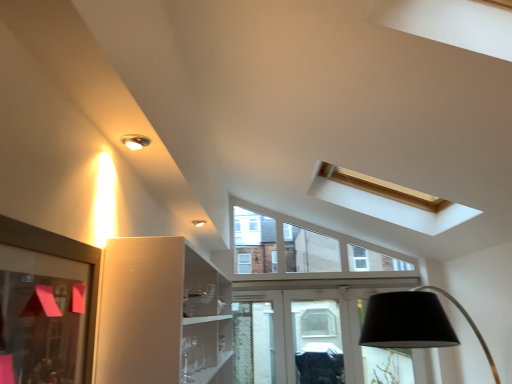
Describe the element at coordinates (135, 141) in the screenshot. I see `matte silver light fixture at upper left` at that location.

The image size is (512, 384). What are the coordinates of `matte silver light fixture at upper left` in the screenshot? It's located at (135, 141).

Describe the element at coordinates (65, 258) in the screenshot. I see `matte glass picture frame at left` at that location.

Locate an element on the screen. This screenshot has height=384, width=512. matte glass picture frame at left is located at coordinates (65, 258).

What are the coordinates of `matte silver light fixture at upper left` in the screenshot? It's located at point(135,141).

Does matte silver light fixture at upper left appear on the right side of matte glass picture frame at left?

Indeed, matte silver light fixture at upper left is positioned on the right side of matte glass picture frame at left.

Is matte silver light fixture at upper left further to the viewer compared to matte glass picture frame at left?

That is True.

Considering the positions of points (124, 141) and (88, 328), is point (124, 141) farther from camera compared to point (88, 328)?

Yes, point (124, 141) is farther from viewer.

From the image's perspective, which object appears higher, matte silver light fixture at upper left or matte glass picture frame at left?

From the image's view, matte silver light fixture at upper left is above.

From a real-world perspective, is matte silver light fixture at upper left below matte glass picture frame at left?

No, from a real-world perspective, matte silver light fixture at upper left is not under matte glass picture frame at left.

Which object is thinner, matte silver light fixture at upper left or matte glass picture frame at left?

Thinner between the two is matte glass picture frame at left.

Is matte silver light fixture at upper left taller or shorter than matte glass picture frame at left?

In the image, matte silver light fixture at upper left appears to be shorter than matte glass picture frame at left.

Between matte silver light fixture at upper left and matte glass picture frame at left, which one has smaller size?

Smaller between the two is matte silver light fixture at upper left.

From the picture: Choose the correct answer: Is matte silver light fixture at upper left inside matte glass picture frame at left or outside it?

The correct answer is: outside.

Are matte silver light fixture at upper left and matte glass picture frame at left located far from each other?

Actually, matte silver light fixture at upper left and matte glass picture frame at left are a little close together.

Could you tell me if matte silver light fixture at upper left is facing matte glass picture frame at left?

No, matte silver light fixture at upper left is not oriented towards matte glass picture frame at left.

Measure the distance between matte silver light fixture at upper left and matte glass picture frame at left.

matte silver light fixture at upper left and matte glass picture frame at left are 20.21 inches apart from each other.

Identify the location of light fixture to the right of matte glass picture frame at left. (135, 141).

In the image, is matte glass picture frame at left on the left side or the right side of matte silver light fixture at upper left?

Based on their positions, matte glass picture frame at left is located to the left of matte silver light fixture at upper left.

Is matte glass picture frame at left further to the viewer compared to matte silver light fixture at upper left?

No, matte glass picture frame at left is closer to the viewer.

Is point (23, 235) more distant than point (127, 135)?

No, (23, 235) is closer to viewer.

From the image's perspective, does matte glass picture frame at left appear higher than matte silver light fixture at upper left?

Incorrect, from the image's perspective, matte glass picture frame at left is lower than matte silver light fixture at upper left.

From a real-world perspective, which is physically below, matte glass picture frame at left or matte silver light fixture at upper left?

From a 3D spatial view, matte glass picture frame at left is below.

Does matte glass picture frame at left have a greater width compared to matte silver light fixture at upper left?

In fact, matte glass picture frame at left might be narrower than matte silver light fixture at upper left.

In terms of height, does matte glass picture frame at left look taller or shorter compared to matte silver light fixture at upper left?

Considering their sizes, matte glass picture frame at left has more height than matte silver light fixture at upper left.

Considering the relative sizes of matte glass picture frame at left and matte silver light fixture at upper left in the image provided, is matte glass picture frame at left bigger than matte silver light fixture at upper left?

Correct, matte glass picture frame at left is larger in size than matte silver light fixture at upper left.

Is matte glass picture frame at left situated inside matte silver light fixture at upper left or outside?

matte glass picture frame at left is outside matte silver light fixture at upper left.

Is matte glass picture frame at left positioned far away from matte silver light fixture at upper left?

Actually, matte glass picture frame at left and matte silver light fixture at upper left are a little close together.

Could you tell me if matte glass picture frame at left is facing matte silver light fixture at upper left?

No, matte glass picture frame at left is not facing towards matte silver light fixture at upper left.

Where is `picture frame below the matte silver light fixture at upper left (from the image's perspective)`? Image resolution: width=512 pixels, height=384 pixels. picture frame below the matte silver light fixture at upper left (from the image's perspective) is located at coordinates (65, 258).

Find the location of `light fixture on the right side of matte glass picture frame at left`. light fixture on the right side of matte glass picture frame at left is located at coordinates (135, 141).

Identify the location of picture frame below the matte silver light fixture at upper left (from the image's perspective). (65, 258).